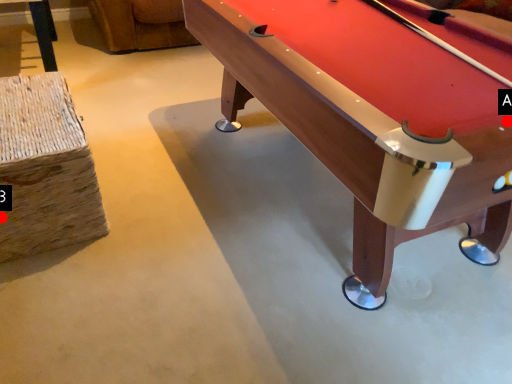
Question: Two points are circled on the image, labeled by A and B beside each circle. Which point is farther to the camera?

Choices:
 (A) A is further
 (B) B is further

Answer: (B)